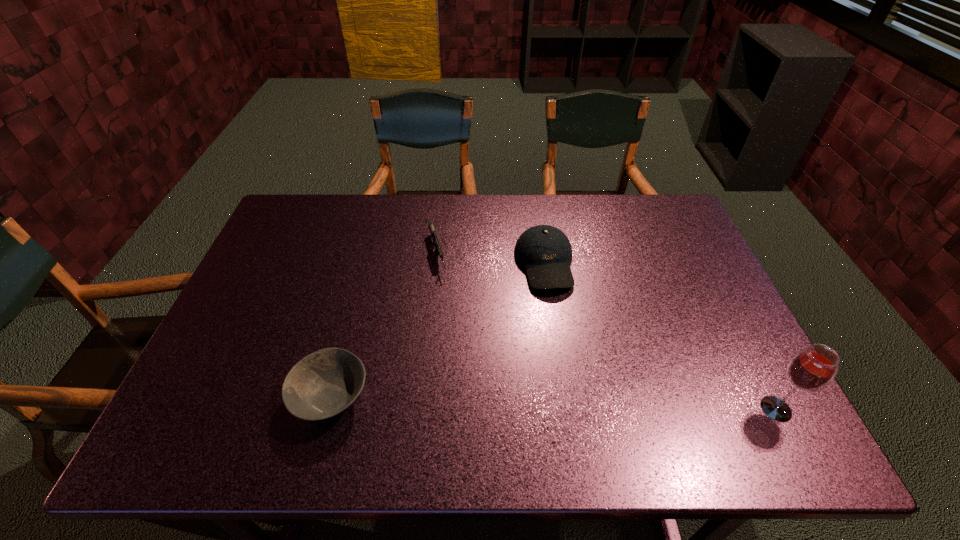
Find the location of a particular element. Image resolution: width=960 pixels, height=540 pixels. vacant space on the desktop that is between the leftmost object and the rightmost object and is positioned on the front-facing side of the second tallest object is located at coordinates (582, 403).

Identify the location of free spot on the desktop that is between the bowl and the tallest object and is positioned aimed along the barrel of the third object from right to left. (485, 401).